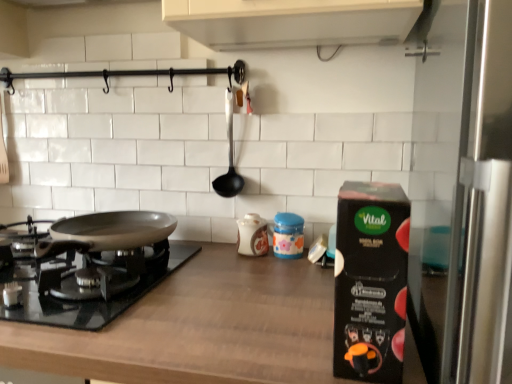
Where is `free location to the left of matte ceramic jar at center, which is the second kitchen appliance in front-to-back order`? This screenshot has width=512, height=384. free location to the left of matte ceramic jar at center, which is the second kitchen appliance in front-to-back order is located at coordinates (219, 258).